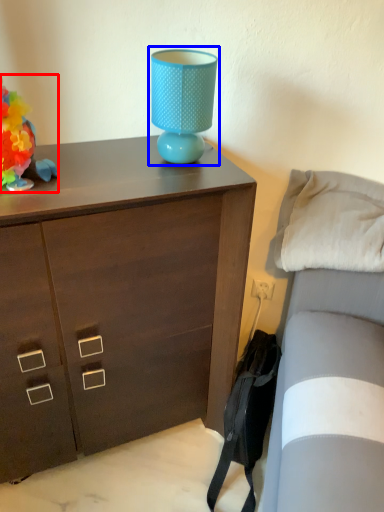
Question: Which object is closer to the camera taking this photo, toy (highlighted by a red box) or table lamp (highlighted by a blue box)?

Choices:
 (A) toy
 (B) table lamp

Answer: (A)